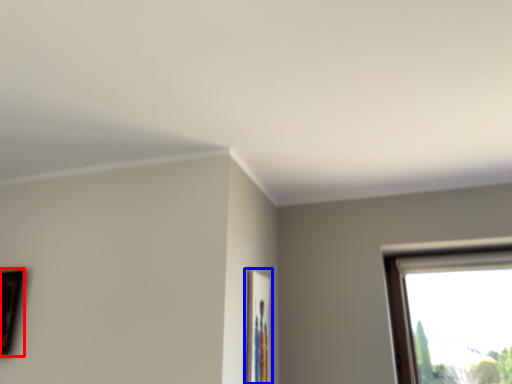
Question: Which object appears closest to the camera in this image, picture frame (highlighted by a red box) or picture frame (highlighted by a blue box)?

Choices:
 (A) picture frame
 (B) picture frame

Answer: (B)